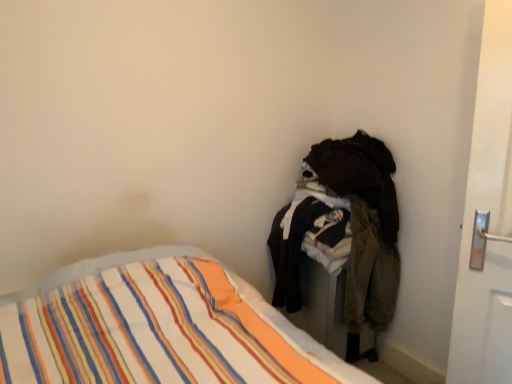
Question: Based on their sizes in the image, would you say dark fabric laundry at right is bigger or smaller than striped fabric bed at lower left?

Choices:
 (A) big
 (B) small

Answer: (B)

Question: Considering the positions of dark fabric laundry at right and striped fabric bed at lower left in the image, is dark fabric laundry at right wider or thinner than striped fabric bed at lower left?

Choices:
 (A) thin
 (B) wide

Answer: (A)

Question: From a real-world perspective, is dark fabric laundry at right positioned above or below striped fabric bed at lower left?

Choices:
 (A) below
 (B) above

Answer: (B)

Question: Does point (202, 253) appear closer or farther from the camera than point (365, 226)?

Choices:
 (A) closer
 (B) farther

Answer: (A)

Question: Is striped fabric bed at lower left spatially inside dark fabric laundry at right, or outside of it?

Choices:
 (A) inside
 (B) outside

Answer: (B)

Question: Based on their positions, is striped fabric bed at lower left located to the left or right of dark fabric laundry at right?

Choices:
 (A) left
 (B) right

Answer: (A)

Question: Considering their positions, is striped fabric bed at lower left located in front of or behind dark fabric laundry at right?

Choices:
 (A) front
 (B) behind

Answer: (A)